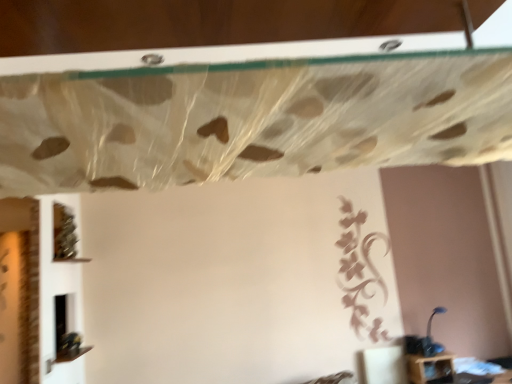
Question: Is translucent plastic curtain at upper center turned away from blue plastic lamp at lower right?

Choices:
 (A) yes
 (B) no

Answer: (B)

Question: Does translucent plastic curtain at upper center lie behind blue plastic lamp at lower right?

Choices:
 (A) yes
 (B) no

Answer: (B)

Question: From the image's perspective, is translucent plastic curtain at upper center under blue plastic lamp at lower right?

Choices:
 (A) no
 (B) yes

Answer: (A)

Question: Is translucent plastic curtain at upper center smaller than blue plastic lamp at lower right?

Choices:
 (A) yes
 (B) no

Answer: (B)

Question: Would you say blue plastic lamp at lower right is part of translucent plastic curtain at upper center's contents?

Choices:
 (A) yes
 (B) no

Answer: (B)

Question: Is point (x=58, y=246) positioned closer to the camera than point (x=76, y=157)?

Choices:
 (A) closer
 (B) farther

Answer: (B)

Question: From a real-world perspective, is green matte vine at lower left above or below translucent plastic curtain at upper center?

Choices:
 (A) above
 (B) below

Answer: (A)

Question: Is green matte vine at lower left inside the boundaries of translucent plastic curtain at upper center, or outside?

Choices:
 (A) inside
 (B) outside

Answer: (B)

Question: Based on their sizes in the image, would you say green matte vine at lower left is bigger or smaller than translucent plastic curtain at upper center?

Choices:
 (A) small
 (B) big

Answer: (A)

Question: Based on their sizes in the image, would you say green matte vine at lower left is bigger or smaller than blue plastic lamp at lower right?

Choices:
 (A) big
 (B) small

Answer: (A)

Question: Is green matte vine at lower left wider or thinner than blue plastic lamp at lower right?

Choices:
 (A) wide
 (B) thin

Answer: (B)

Question: Does point (57, 228) appear closer or farther from the camera than point (430, 354)?

Choices:
 (A) farther
 (B) closer

Answer: (B)

Question: Considering the positions of green matte vine at lower left and blue plastic lamp at lower right in the image, is green matte vine at lower left taller or shorter than blue plastic lamp at lower right?

Choices:
 (A) tall
 (B) short

Answer: (A)

Question: Is point (433, 344) closer or farther from the camera than point (156, 127)?

Choices:
 (A) farther
 (B) closer

Answer: (A)

Question: Based on their sizes in the image, would you say blue plastic lamp at lower right is bigger or smaller than translucent plastic curtain at upper center?

Choices:
 (A) big
 (B) small

Answer: (B)